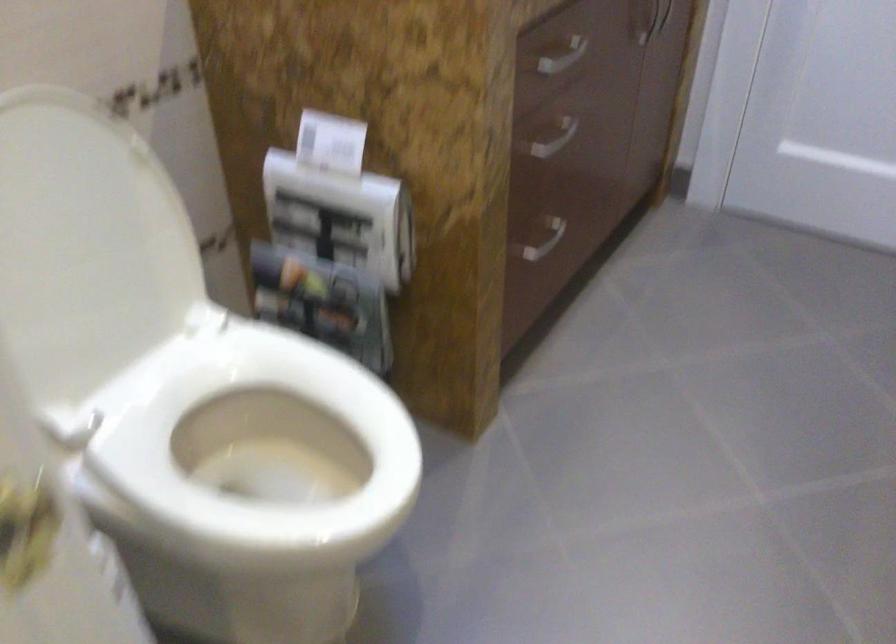
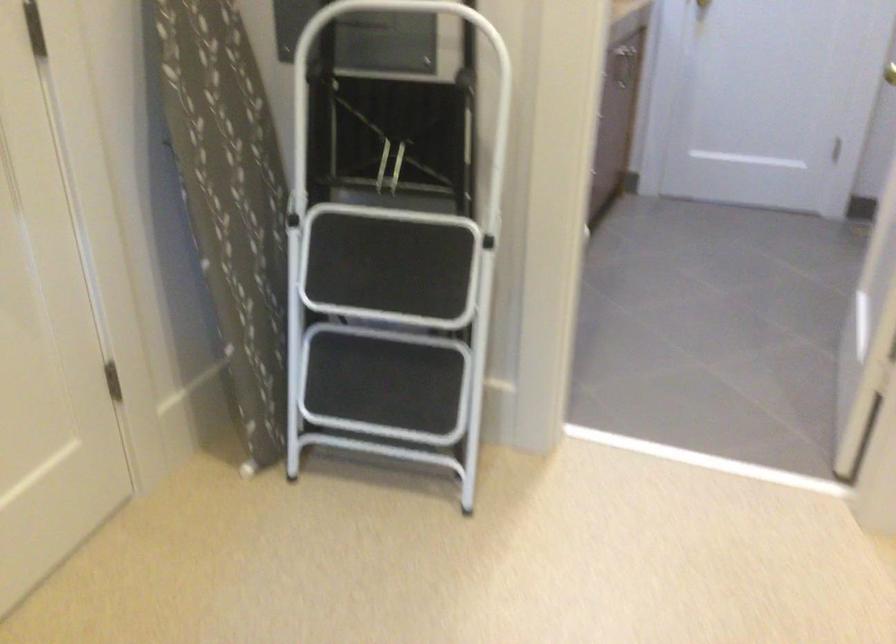
Question: I am providing you with two images of the same scene from different viewpoints. Which of the following objects are not visible in image2?

Choices:
 (A) white stool handle
 (B) gold door handle
 (C) silver drawer handle
 (D) cowhide stool

Answer: (C)